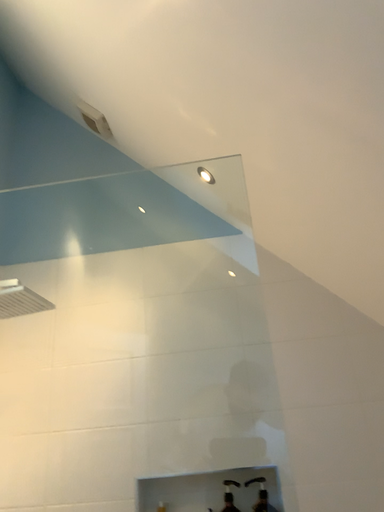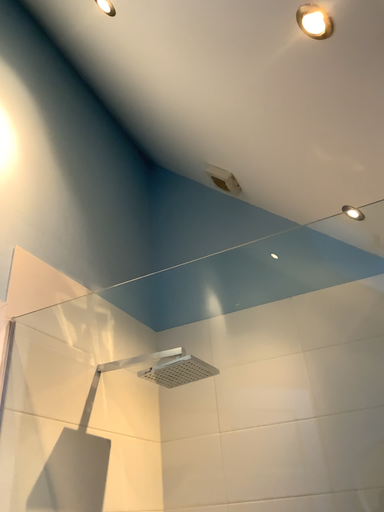
Question: How did the camera likely rotate when shooting the video?

Choices:
 (A) rotated right
 (B) rotated left

Answer: (B)